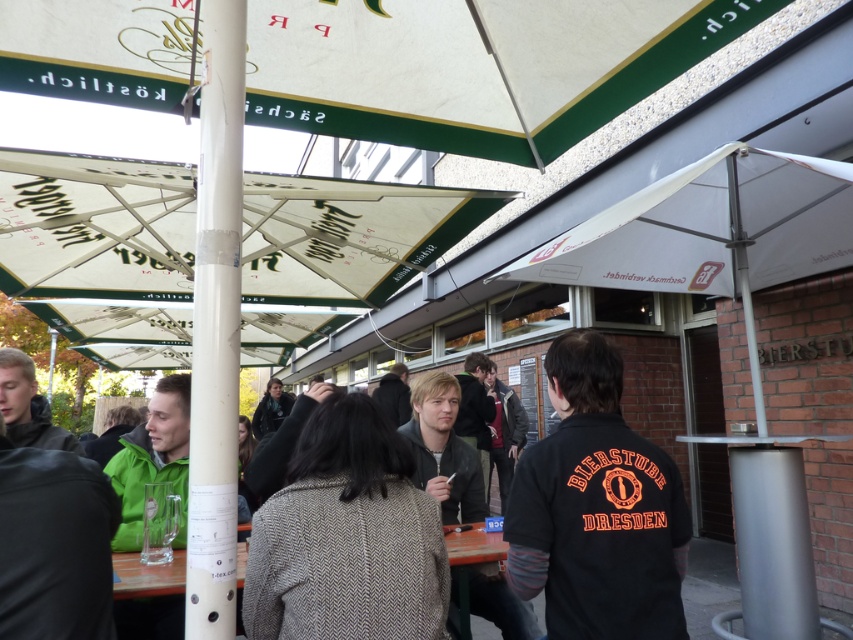
Can you confirm if brown herringbone coat at center is positioned below clear glass table at center?

No.

The image size is (853, 640). I want to click on brown herringbone coat at center, so click(x=346, y=536).

Between black cotton shirt at center and brown herringbone coat at center, which one appears on the right side from the viewer's perspective?

black cotton shirt at center

This screenshot has width=853, height=640. What are the coordinates of `black cotton shirt at center` in the screenshot? It's located at (596, 509).

Locate an element on the screen. black cotton shirt at center is located at coordinates (596, 509).

Is point (422, 124) closer to viewer compared to point (291, 396)?

Yes, it is.

Between point (521, 20) and point (282, 419), which one is positioned in front?

Positioned in front is point (521, 20).

The image size is (853, 640). I want to click on white textured canopy at upper center, so click(474, 67).